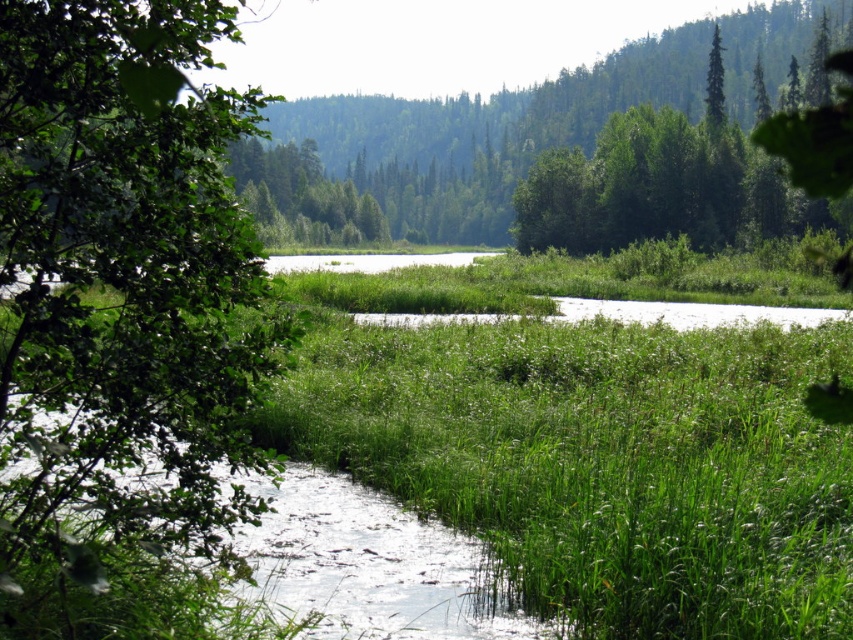
Based on the photo, you are a hiker standing at the edge of the stream in the foreground of this serene landscape. You notice the green grass at center and the green leafy tree at upper right. Which object would appear larger to you from your current position?

The green grass at center appears larger because it is closer to the viewer than the green leafy tree at upper right.

You are standing at the center of the image and want to walk towards the green leafy tree at left. In which direction should you move?

The green leafy tree at left is located at point 0.514 on the x axis and 0.148 on the y axis. Since you are at the center, you should move towards the left and slightly downward to reach it.